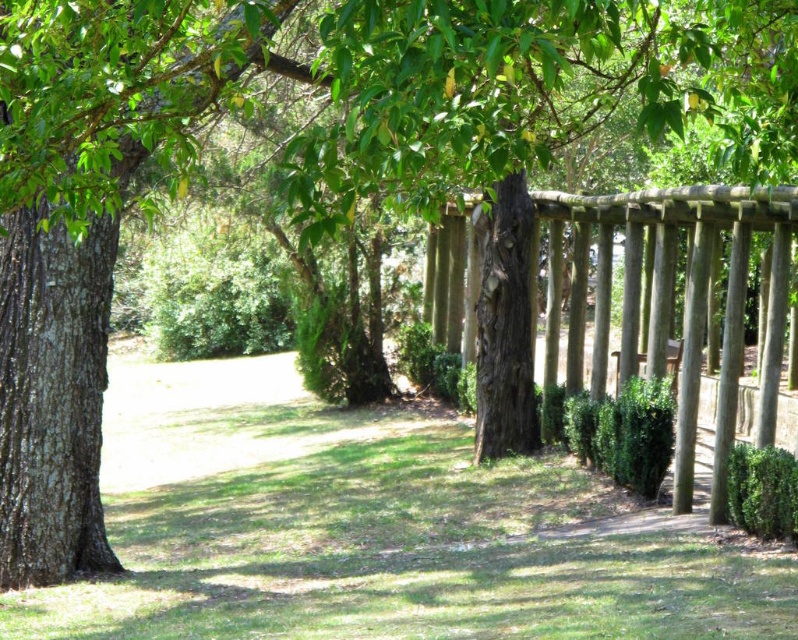
You are a gardener who wants to plant a new flower bed between the green grass at center and the green leafy hedge at center. Which object should you place the flowers closer to if you want them to grow taller?

The green leafy hedge at center is taller than the green grass at center, so planting the flowers closer to the green leafy hedge at center would provide better conditions for growth.